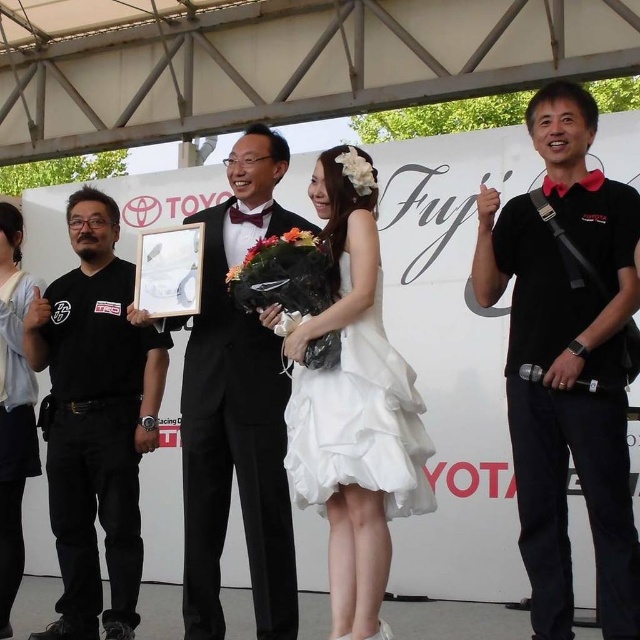
Question: Does black matte shirt at right come in front of white silk flower at center?

Choices:
 (A) yes
 (B) no

Answer: (A)

Question: Estimate the real-world distances between objects in this image. Which object is closer to the black matte shirt at right?

Choices:
 (A) black matte t-shirt at left
 (B) light blue fabric dress at center
 (C) white silk flower at center

Answer: (C)

Question: Which of the following is the closest to the observer?

Choices:
 (A) white satin dress at center
 (B) black matte t-shirt at left
 (C) black matte shirt at right
 (D) black satin tuxedo at center

Answer: (A)

Question: Is white satin dress at center wider than floral bouquet at center?

Choices:
 (A) yes
 (B) no

Answer: (A)

Question: Which point is farther to the camera?

Choices:
 (A) black matte shirt at right
 (B) black satin tuxedo at center
 (C) white fabric flower at center

Answer: (B)

Question: Can you confirm if black matte t-shirt at left is bigger than floral bouquet at center?

Choices:
 (A) no
 (B) yes

Answer: (B)